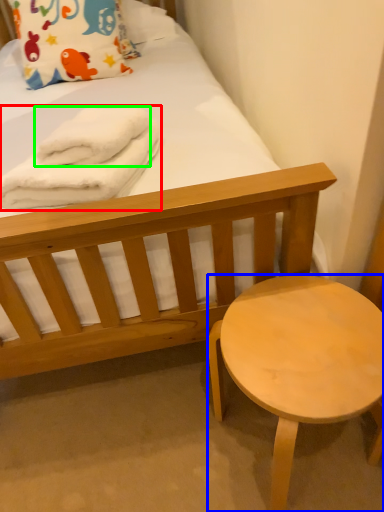
Question: Which object is positioned farthest from bath towel (highlighted by a red box)? Select from stool (highlighted by a blue box) and bath towel (highlighted by a green box).

Choices:
 (A) stool
 (B) bath towel

Answer: (A)